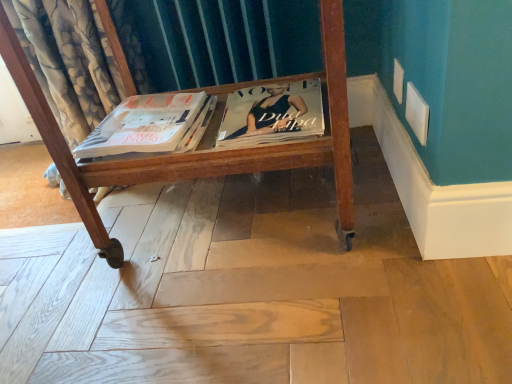
Question: Is matte black magazine at center facing away from wooden cart at center?

Choices:
 (A) yes
 (B) no

Answer: (A)

Question: Is the depth of matte black magazine at center greater than that of wooden cart at center?

Choices:
 (A) yes
 (B) no

Answer: (A)

Question: Does matte black magazine at center come in front of wooden cart at center?

Choices:
 (A) yes
 (B) no

Answer: (B)

Question: Is matte black magazine at center at the left side of wooden cart at center?

Choices:
 (A) no
 (B) yes

Answer: (A)

Question: Can you confirm if matte black magazine at center is taller than wooden cart at center?

Choices:
 (A) no
 (B) yes

Answer: (A)

Question: Is matte black magazine at center positioned far away from wooden cart at center?

Choices:
 (A) yes
 (B) no

Answer: (B)

Question: Is wooden cart at center facing towards matte white magazine at center?

Choices:
 (A) no
 (B) yes

Answer: (B)

Question: Considering the relative sizes of wooden cart at center and matte white magazine at center in the image provided, is wooden cart at center smaller than matte white magazine at center?

Choices:
 (A) no
 (B) yes

Answer: (A)

Question: Considering the relative sizes of wooden cart at center and matte white magazine at center in the image provided, is wooden cart at center taller than matte white magazine at center?

Choices:
 (A) yes
 (B) no

Answer: (A)

Question: Can you confirm if wooden cart at center is bigger than matte white magazine at center?

Choices:
 (A) no
 (B) yes

Answer: (B)

Question: Does wooden cart at center appear on the right side of matte white magazine at center?

Choices:
 (A) yes
 (B) no

Answer: (A)

Question: From a real-world perspective, is wooden cart at center physically below matte white magazine at center?

Choices:
 (A) no
 (B) yes

Answer: (A)

Question: Can you confirm if matte white magazine at center is smaller than matte black magazine at center?

Choices:
 (A) yes
 (B) no

Answer: (A)